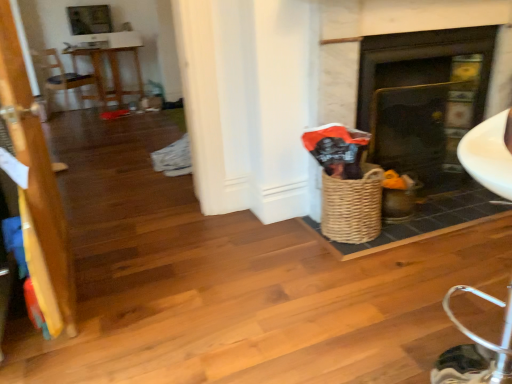
This screenshot has width=512, height=384. In order to click on vacant space in front of matte black fireplace at center in this screenshot , I will do `click(432, 218)`.